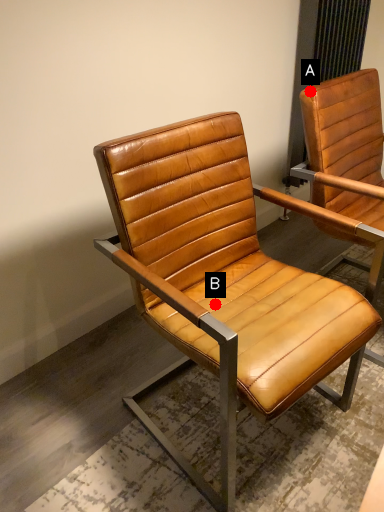
Question: Two points are circled on the image, labeled by A and B beside each circle. Which point appears farthest from the camera in this image?

Choices:
 (A) A is further
 (B) B is further

Answer: (A)